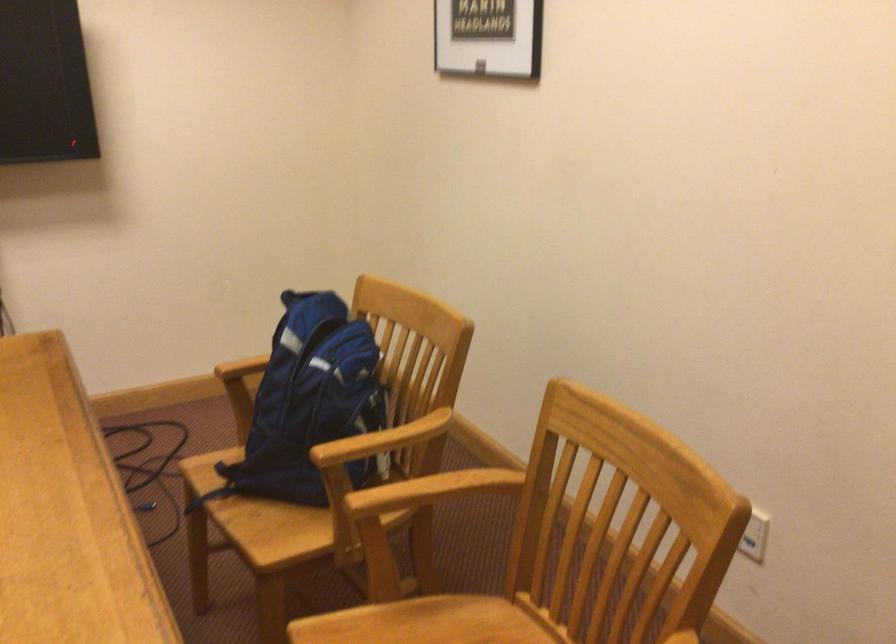
Describe the element at coordinates (415, 627) in the screenshot. I see `the chair sitting surface` at that location.